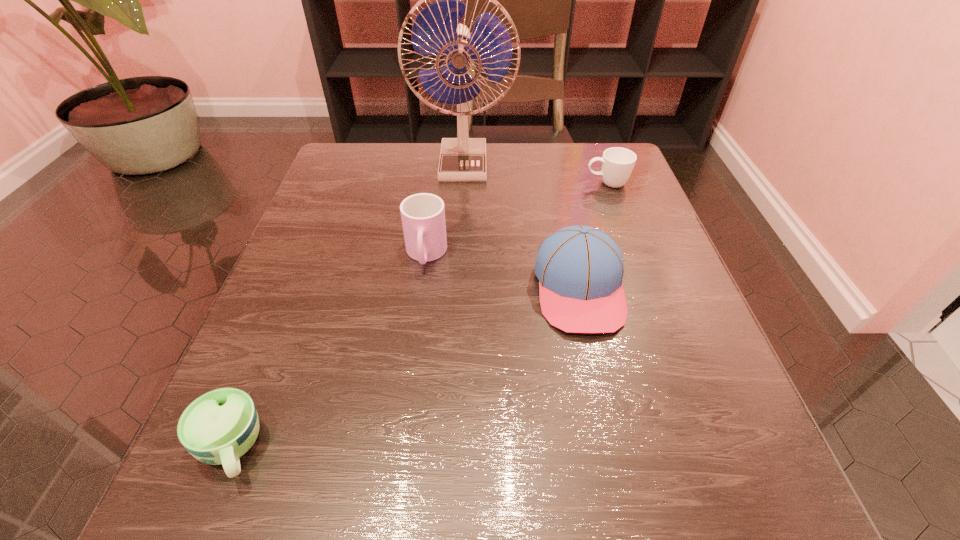
This screenshot has height=540, width=960. In order to click on vacant space located 0.060m with the handle on the side of the farthest cup in this screenshot , I will do `click(559, 184)`.

The width and height of the screenshot is (960, 540). Identify the location of vacant space situated with the handle on the side of the farthest cup. (488, 184).

Image resolution: width=960 pixels, height=540 pixels. Find the location of `vacant space situated with the handle on the side of the farthest cup`. vacant space situated with the handle on the side of the farthest cup is located at coordinates (492, 184).

At what (x,y) coordinates should I click in order to perform the action: click on vacant space located on the right of the nearest cup. Please return your answer as a coordinate pair (x, y). Image resolution: width=960 pixels, height=540 pixels. Looking at the image, I should click on (382, 448).

Identify the location of fan situated at the far edge. The width and height of the screenshot is (960, 540). (435, 30).

You are a GUI agent. You are given a task and a screenshot of the screen. Output one action in this format:
    pyautogui.click(x=<x>, y=<y>)
    Task: Click on the cup present at the far edge
    
    Given the screenshot: What is the action you would take?
    pyautogui.click(x=617, y=163)

Where is `object present at the near edge`? This screenshot has width=960, height=540. object present at the near edge is located at coordinates (220, 426).

Where is `object that is positioned at the left edge`? The width and height of the screenshot is (960, 540). object that is positioned at the left edge is located at coordinates (220, 426).

I want to click on baseball cap located at the right edge, so click(580, 269).

Image resolution: width=960 pixels, height=540 pixels. Find the location of `cup situated at the right edge`. cup situated at the right edge is located at coordinates (617, 163).